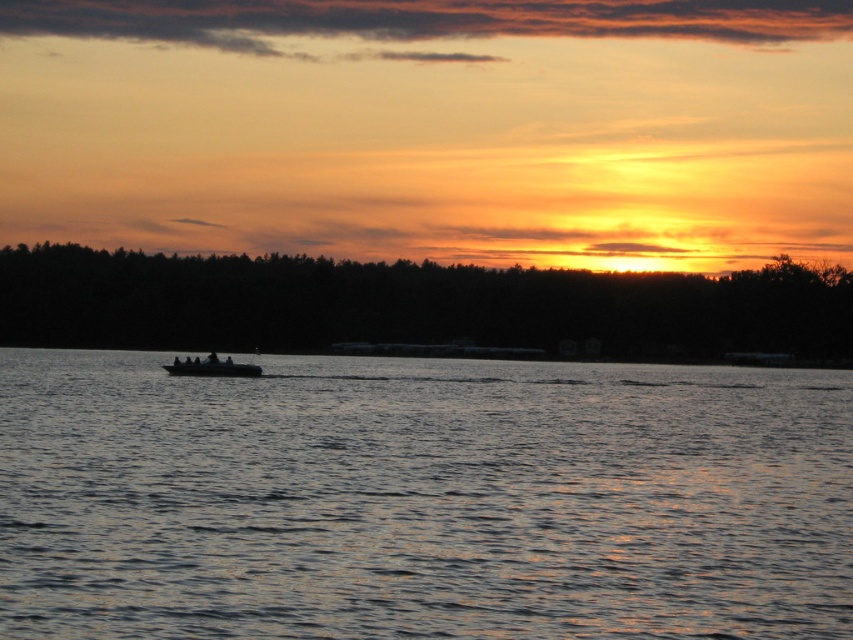
You are standing on the shore of the sunset scene and want to locate two specific points marked in the water. The first point is at coordinates point (97, 388), and the second is at point (164, 364). From your perspective, which point appears closer to you?

Point (97, 388) is in front of point (164, 364), so it appears closer to you.

You are a photographer trying to capture the sunset scene. You notice the dark blue water at center and the dark gray metallic boat at center in your viewfinder. Which object appears larger in height in the photo?

The dark blue water at center appears much taller than the dark gray metallic boat at center in the photo.